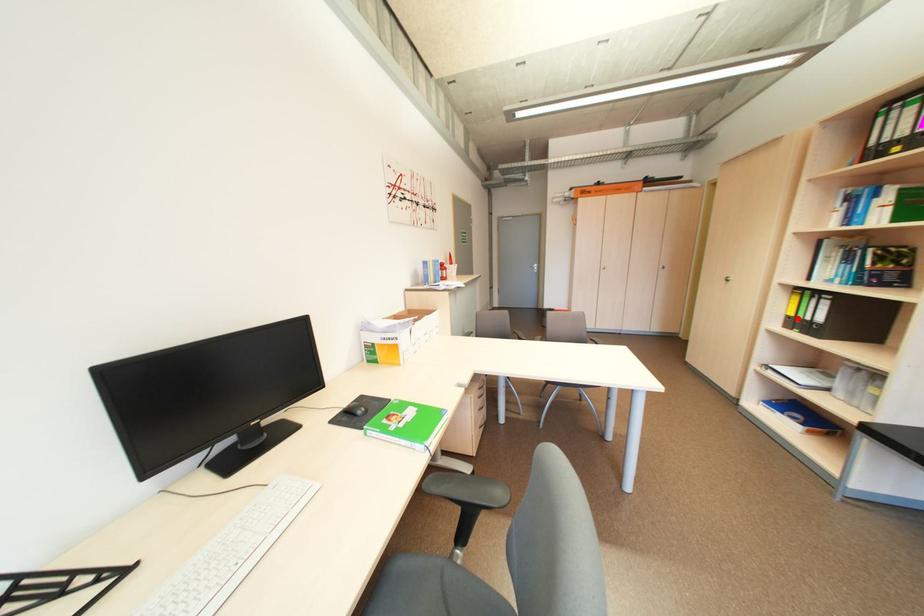
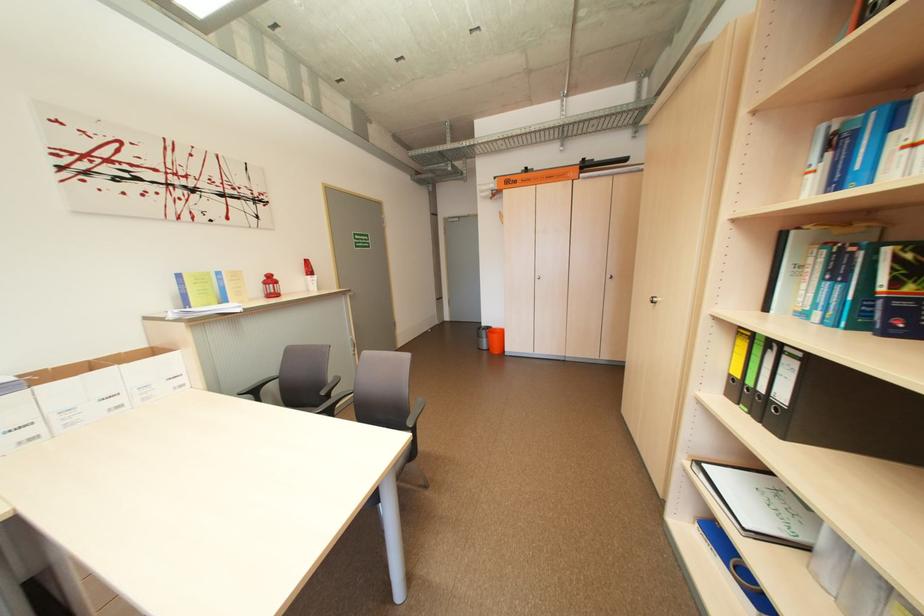
Question: I am providing you with two images of the same scene from different viewpoints. A red point is marked on the first image. Can you still see the location of the red point in image 2?

Choices:
 (A) Yes
 (B) No

Answer: (A)